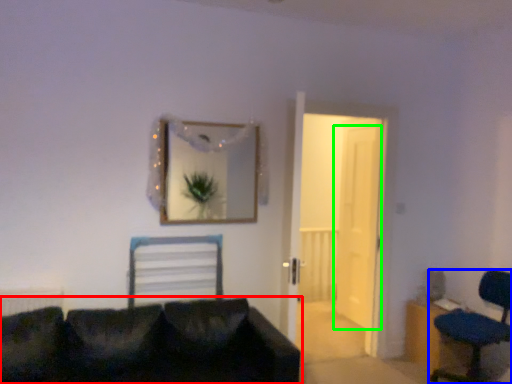
Question: Which object is the farthest from studio couch (highlighted by a red box)? Choose among these: chair (highlighted by a blue box) or door (highlighted by a green box).

Choices:
 (A) chair
 (B) door

Answer: (B)